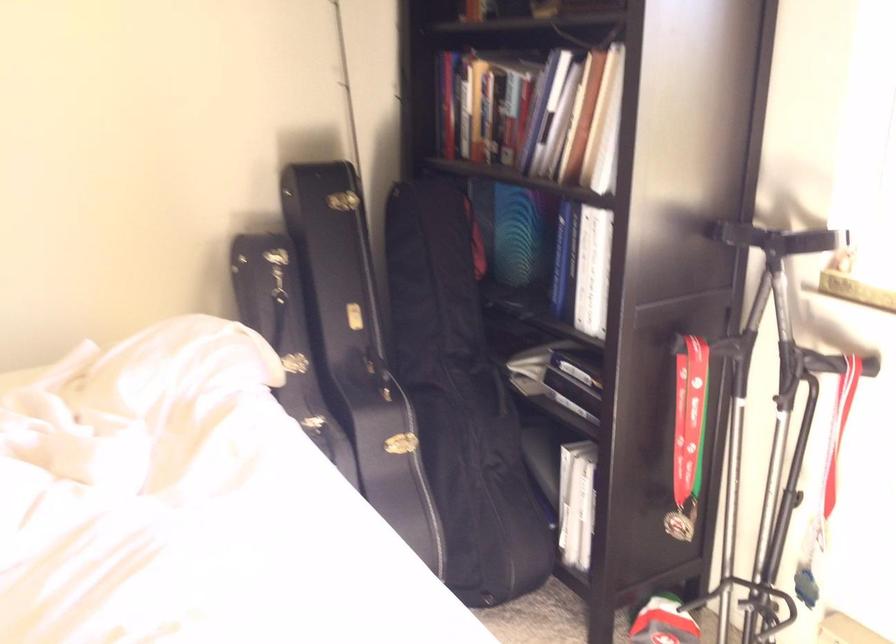
The location [764,413] corresponds to which object?

It corresponds to the black music stand in the image.